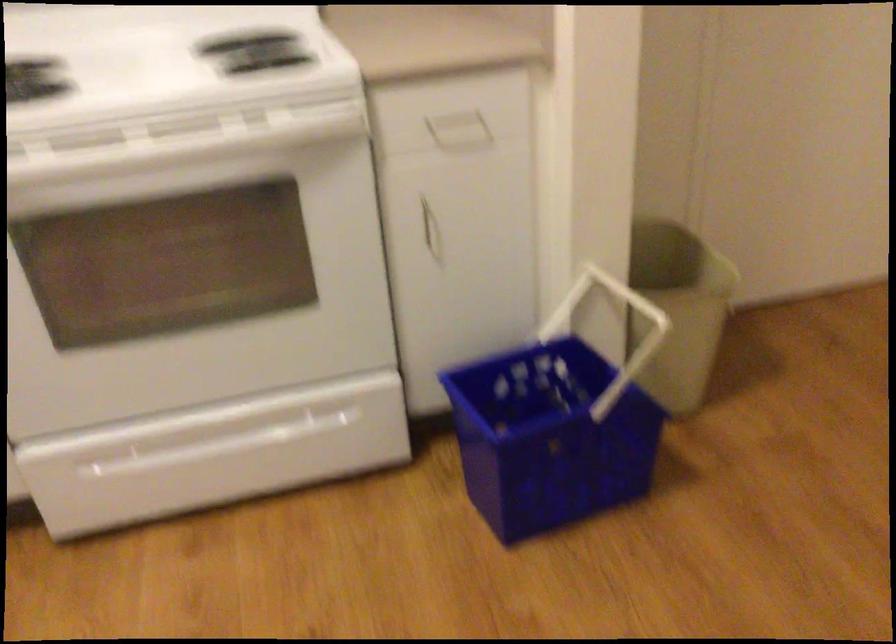
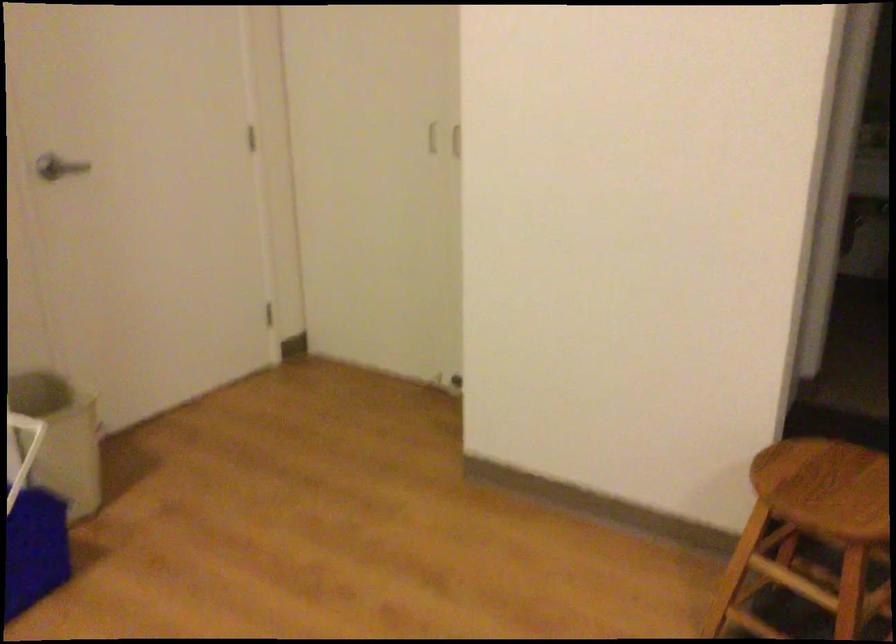
Question: The images are taken continuously from a first-person perspective. In which direction is your viewpoint rotating?

Choices:
 (A) Left
 (B) Right
 (C) Up
 (D) Down

Answer: (B)